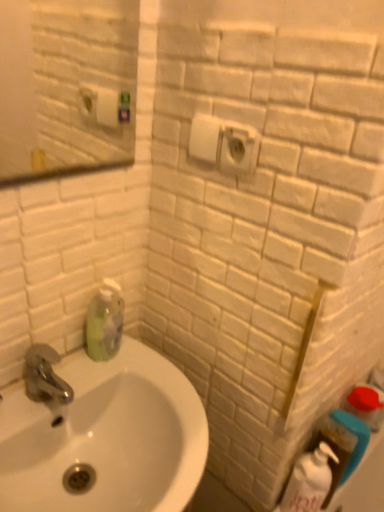
Measure the distance between point (105, 391) and camera.

A distance of 35.39 inches exists between point (105, 391) and camera.

You are a GUI agent. You are given a task and a screenshot of the screen. Output one action in this format:
    pyautogui.click(x=<x>, y=<y>)
    Task: Click on the white glossy bottle at lower right, the 2th cleaning product in the top-to-bottom sequence
    This screenshot has height=512, width=384.
    Given the screenshot: What is the action you would take?
    pyautogui.click(x=309, y=481)

This screenshot has height=512, width=384. What do you see at coordinates (309, 481) in the screenshot?
I see `white glossy bottle at lower right, the 2th cleaning product in the top-to-bottom sequence` at bounding box center [309, 481].

Describe the element at coordinates (105, 322) in the screenshot. The height and width of the screenshot is (512, 384). I see `green matte bottle at lower left, the 1th cleaning product viewed from the left` at that location.

Find the location of a particular element. This screenshot has width=384, height=512. white glossy sink at lower left is located at coordinates (106, 437).

Where is `sink in front of the white glossy bottle at lower right, which is the first cleaning product from right to left`? sink in front of the white glossy bottle at lower right, which is the first cleaning product from right to left is located at coordinates (106, 437).

In the image, is white glossy bottle at lower right, the 2th cleaning product in the top-to-bottom sequence, positioned in front of or behind white glossy sink at lower left?

Clearly, white glossy bottle at lower right, the 2th cleaning product in the top-to-bottom sequence, is behind white glossy sink at lower left.

From the image's perspective, which object appears higher, white glossy bottle at lower right, the 2th cleaning product positioned from the left, or white glossy sink at lower left?

Answer: From the image's view, white glossy sink at lower left is above.

Is white plastic electric outlet at upper center turned away from white glossy bottle at lower right, the 2th cleaning product in the top-to-bottom sequence?

No, white plastic electric outlet at upper center's orientation is not away from white glossy bottle at lower right, the 2th cleaning product in the top-to-bottom sequence.

How different are the orientations of white plastic electric outlet at upper center and white glossy bottle at lower right, which is the first cleaning product from right to left, in degrees?

The facing directions of white plastic electric outlet at upper center and white glossy bottle at lower right, which is the first cleaning product from right to left, are 49.6 degrees apart.

In terms of height, does white plastic electric outlet at upper center look taller or shorter compared to white glossy bottle at lower right, which is the first cleaning product from right to left?

Clearly, white plastic electric outlet at upper center is shorter compared to white glossy bottle at lower right, which is the first cleaning product from right to left.

Between point (221, 149) and point (319, 480), which one is positioned behind?

Positioned behind is point (319, 480).

From a real-world perspective, starting from the white plastic electric outlet at upper center, which cleaning product is the 1st one below it? Please provide its 2D coordinates.

[(105, 322)]

Is white plastic electric outlet at upper center positioned far away from green matte bottle at lower left, which is the second cleaning product from right to left?

No, white plastic electric outlet at upper center is not far from green matte bottle at lower left, which is the second cleaning product from right to left.

Is point (236, 173) closer or farther from the camera than point (87, 353)?

Point (236, 173) is closer to the camera than point (87, 353).

Which object is further away from the camera taking this photo, white plastic electric outlet at upper center or green matte bottle at lower left, the 2th cleaning product from the bottom?

green matte bottle at lower left, the 2th cleaning product from the bottom, is further away from the camera.

Is white glossy bottle at lower right, which is the first cleaning product from right to left, turned away from white plastic electric outlet at upper center?

That's not correct — white glossy bottle at lower right, which is the first cleaning product from right to left, is not looking away from white plastic electric outlet at upper center.

From a real-world perspective, is white glossy bottle at lower right, which is the first cleaning product from right to left, positioned under white plastic electric outlet at upper center based on gravity?

Indeed, from a real-world perspective, white glossy bottle at lower right, which is the first cleaning product from right to left, is positioned beneath white plastic electric outlet at upper center.

From the image's perspective, is white glossy bottle at lower right, which is the first cleaning product from right to left, over white plastic electric outlet at upper center?

Incorrect, from the image's perspective, white glossy bottle at lower right, which is the first cleaning product from right to left, is lower than white plastic electric outlet at upper center.

Can we say white glossy sink at lower left lies outside white glossy bottle at lower right, the 2th cleaning product in the top-to-bottom sequence?

That's correct, white glossy sink at lower left is outside of white glossy bottle at lower right, the 2th cleaning product in the top-to-bottom sequence.

Is white glossy sink at lower left closer to the viewer compared to white glossy bottle at lower right, positioned as the 1th cleaning product in bottom-to-top order?

Yes, white glossy sink at lower left is in front of white glossy bottle at lower right, positioned as the 1th cleaning product in bottom-to-top order.

Between white glossy sink at lower left and white glossy bottle at lower right, the 2th cleaning product in the top-to-bottom sequence, which one has smaller width?

With smaller width is white glossy bottle at lower right, the 2th cleaning product in the top-to-bottom sequence.

Can white glossy sink at lower left be found inside green matte bottle at lower left, marked as the first cleaning product in a top-to-bottom arrangement?

No, white glossy sink at lower left is located outside of green matte bottle at lower left, marked as the first cleaning product in a top-to-bottom arrangement.

Is green matte bottle at lower left, the 2th cleaning product from the bottom, facing away from white glossy sink at lower left?

No, green matte bottle at lower left, the 2th cleaning product from the bottom, is not facing away from white glossy sink at lower left.

Is green matte bottle at lower left, marked as the first cleaning product in a top-to-bottom arrangement, far away from white glossy sink at lower left?

green matte bottle at lower left, marked as the first cleaning product in a top-to-bottom arrangement, is actually quite close to white glossy sink at lower left.

Considering the positions of objects green matte bottle at lower left, the 1th cleaning product viewed from the left, and white glossy sink at lower left in the image provided, who is more to the left, green matte bottle at lower left, the 1th cleaning product viewed from the left, or white glossy sink at lower left?

green matte bottle at lower left, the 1th cleaning product viewed from the left.

From the image's perspective, which is below, white glossy sink at lower left or white plastic electric outlet at upper center?

white glossy sink at lower left.

Is white glossy sink at lower left facing towards white plastic electric outlet at upper center?

No, white glossy sink at lower left does not turn towards white plastic electric outlet at upper center.

Considering the positions of objects white glossy sink at lower left and white plastic electric outlet at upper center in the image provided, who is in front, white glossy sink at lower left or white plastic electric outlet at upper center?

white glossy sink at lower left is more forward.

Looking at this image, who is smaller, white glossy sink at lower left or white plastic electric outlet at upper center?

white plastic electric outlet at upper center.

Identify the location of cleaning product below the white glossy sink at lower left (from the image's perspective). (309, 481).

Image resolution: width=384 pixels, height=512 pixels. I want to click on electric outlet located above the white glossy bottle at lower right, the 2th cleaning product in the top-to-bottom sequence (from a real-world perspective), so click(224, 144).

From the image, which object appears to be farther from white plastic electric outlet at upper center, white glossy sink at lower left or white glossy bottle at lower right, which is the first cleaning product from right to left?

white glossy bottle at lower right, which is the first cleaning product from right to left, is further to white plastic electric outlet at upper center.

Looking at the image, which one is located further to green matte bottle at lower left, marked as the first cleaning product in a top-to-bottom arrangement, white glossy bottle at lower right, positioned as the 1th cleaning product in bottom-to-top order, or white plastic electric outlet at upper center?

Among the two, white glossy bottle at lower right, positioned as the 1th cleaning product in bottom-to-top order, is located further to green matte bottle at lower left, marked as the first cleaning product in a top-to-bottom arrangement.

Based on their spatial positions, is green matte bottle at lower left, the 1th cleaning product viewed from the left, or white glossy sink at lower left further from white plastic electric outlet at upper center?

white glossy sink at lower left is positioned further to the anchor white plastic electric outlet at upper center.

From the image, which object appears to be farther from green matte bottle at lower left, marked as the first cleaning product in a top-to-bottom arrangement, white glossy sink at lower left or white plastic electric outlet at upper center?

white plastic electric outlet at upper center lies further to green matte bottle at lower left, marked as the first cleaning product in a top-to-bottom arrangement, than the other object.

Which object lies nearer to the anchor point white glossy bottle at lower right, positioned as the 1th cleaning product in bottom-to-top order, white plastic electric outlet at upper center or green matte bottle at lower left, which is the second cleaning product from right to left?

Among the two, green matte bottle at lower left, which is the second cleaning product from right to left, is located nearer to white glossy bottle at lower right, positioned as the 1th cleaning product in bottom-to-top order.

From the image, which object appears to be farther from green matte bottle at lower left, which is the second cleaning product from right to left, white glossy bottle at lower right, the 2th cleaning product in the top-to-bottom sequence, or white glossy sink at lower left?

white glossy bottle at lower right, the 2th cleaning product in the top-to-bottom sequence.

When comparing their distances from white glossy bottle at lower right, which is the first cleaning product from right to left, does white glossy sink at lower left or white plastic electric outlet at upper center seem further?

Based on the image, white plastic electric outlet at upper center appears to be further to white glossy bottle at lower right, which is the first cleaning product from right to left.

Which object lies further to the anchor point white glossy bottle at lower right, the 2th cleaning product in the top-to-bottom sequence, green matte bottle at lower left, which is the second cleaning product from right to left, or white plastic electric outlet at upper center?

Based on the image, white plastic electric outlet at upper center appears to be further to white glossy bottle at lower right, the 2th cleaning product in the top-to-bottom sequence.

This screenshot has width=384, height=512. I want to click on sink between green matte bottle at lower left, the 2th cleaning product from the bottom, and white glossy bottle at lower right, which is the first cleaning product from right to left, from left to right, so click(106, 437).

The image size is (384, 512). Find the location of `sink between white plastic electric outlet at upper center and white glossy bottle at lower right, the 2th cleaning product positioned from the left, vertically`. sink between white plastic electric outlet at upper center and white glossy bottle at lower right, the 2th cleaning product positioned from the left, vertically is located at coordinates (106, 437).

The height and width of the screenshot is (512, 384). What are the coordinates of `cleaning product between white plastic electric outlet at upper center and white glossy sink at lower left in the vertical direction` in the screenshot? It's located at (105, 322).

Image resolution: width=384 pixels, height=512 pixels. In order to click on cleaning product that lies between white plastic electric outlet at upper center and white glossy bottle at lower right, the 2th cleaning product positioned from the left, from top to bottom in this screenshot , I will do `click(105, 322)`.